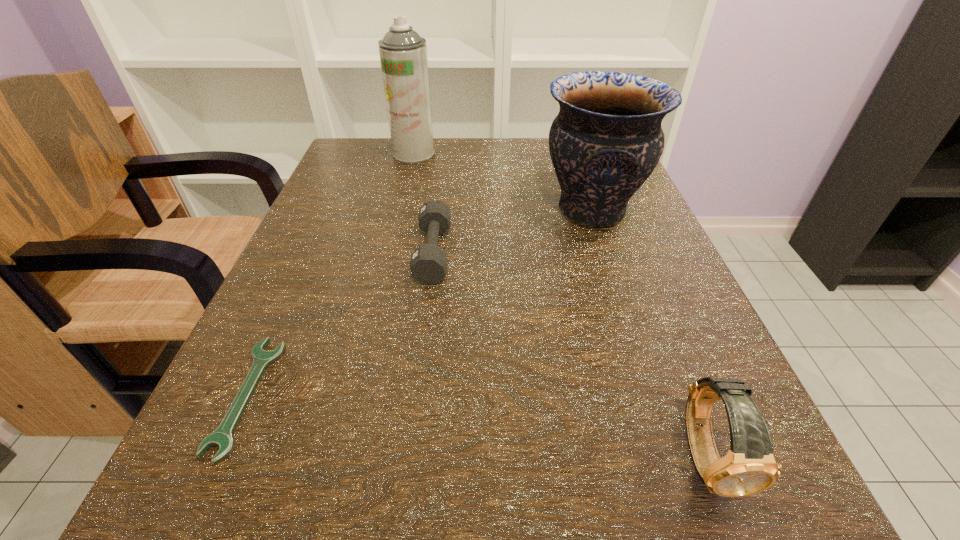
The height and width of the screenshot is (540, 960). In order to click on the tallest object in this screenshot , I will do `click(403, 53)`.

What are the coordinates of `aerosol can` in the screenshot? It's located at (403, 53).

Identify the location of the fourth shortest object. (606, 140).

At what (x,y) coordinates should I click in order to perform the action: click on watch. Please return your answer as a coordinate pair (x, y). This screenshot has height=540, width=960. Looking at the image, I should click on (749, 467).

You are a GUI agent. You are given a task and a screenshot of the screen. Output one action in this format:
    pyautogui.click(x=<x>, y=<y>)
    Task: Click on the second shortest object
    The width and height of the screenshot is (960, 540).
    Given the screenshot: What is the action you would take?
    pyautogui.click(x=428, y=264)

Find the location of `the shortest object`. the shortest object is located at coordinates (222, 437).

The height and width of the screenshot is (540, 960). In order to click on wrench in this screenshot , I will do `click(222, 437)`.

At what (x,y) coordinates should I click in order to perform the action: click on vacant space located 0.160m on the front of the tallest object. Please return your answer as a coordinate pair (x, y). Looking at the image, I should click on (402, 202).

Find the location of `free space located on the front handle of the fourth shortest object`. free space located on the front handle of the fourth shortest object is located at coordinates (466, 211).

This screenshot has width=960, height=540. In order to click on free location located on the front handle of the fourth shortest object in this screenshot , I will do `click(419, 211)`.